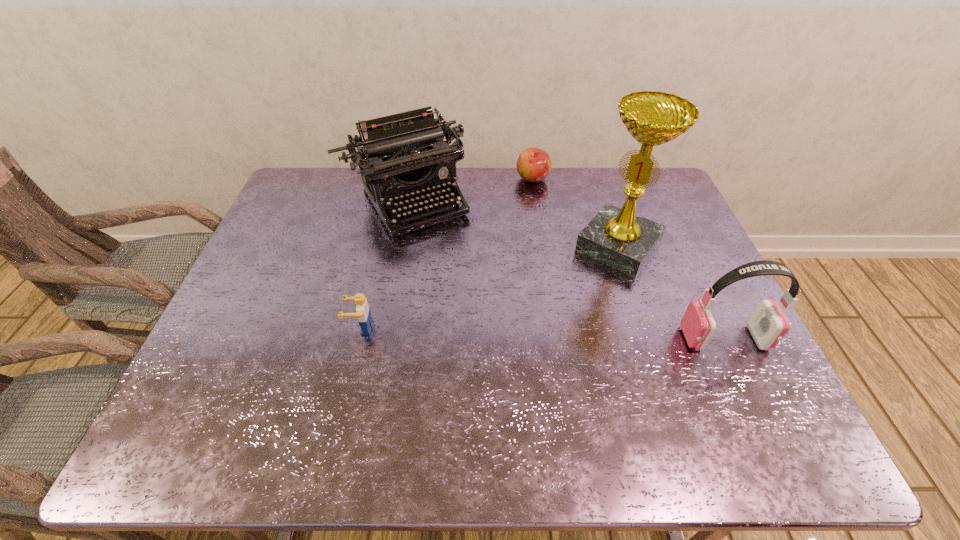
Where is `vacant space situated on the outer surface of the earphone`? The width and height of the screenshot is (960, 540). vacant space situated on the outer surface of the earphone is located at coordinates (625, 338).

I want to click on vacant space located 0.080m on the stem of the apple, so click(x=540, y=203).

You are a GUI agent. You are given a task and a screenshot of the screen. Output one action in this format:
    pyautogui.click(x=<x>, y=<y>)
    Task: Click on the free region located on the stem of the apple
    This screenshot has width=960, height=540.
    Given the screenshot: What is the action you would take?
    pyautogui.click(x=540, y=203)

Where is `vacant space located 0.280m on the stem of the apple`? The image size is (960, 540). vacant space located 0.280m on the stem of the apple is located at coordinates (552, 244).

Where is `vacant space located 0.150m on the front-facing side of the tallest object`? vacant space located 0.150m on the front-facing side of the tallest object is located at coordinates (572, 305).

In order to click on vacant space positioned 0.080m on the front-facing side of the tallest object in this screenshot , I will do `click(585, 288)`.

Where is `vacant area situated on the front-facing side of the tallest object`? Image resolution: width=960 pixels, height=540 pixels. vacant area situated on the front-facing side of the tallest object is located at coordinates (568, 309).

Locate an element on the screen. free region located 0.100m on the keyboard of the typewriter is located at coordinates (444, 257).

You are a GUI agent. You are given a task and a screenshot of the screen. Output one action in this format:
    pyautogui.click(x=<x>, y=<y>)
    Task: Click on the vacant area situated on the keyboard of the typewriter
    
    Given the screenshot: What is the action you would take?
    pyautogui.click(x=458, y=277)

I want to click on free space located 0.210m on the keyboard of the typewriter, so click(x=461, y=282).